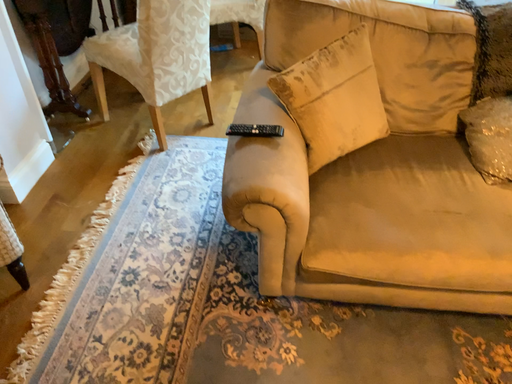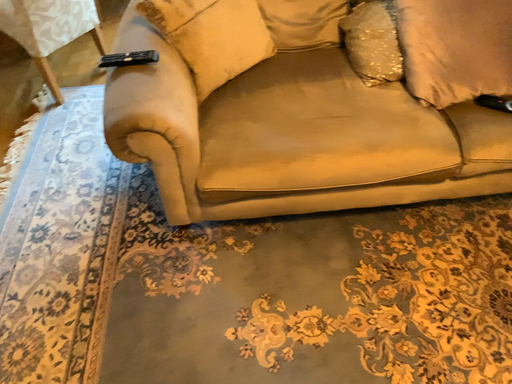
Question: Which way did the camera rotate in the video?

Choices:
 (A) rotated left
 (B) rotated right

Answer: (B)